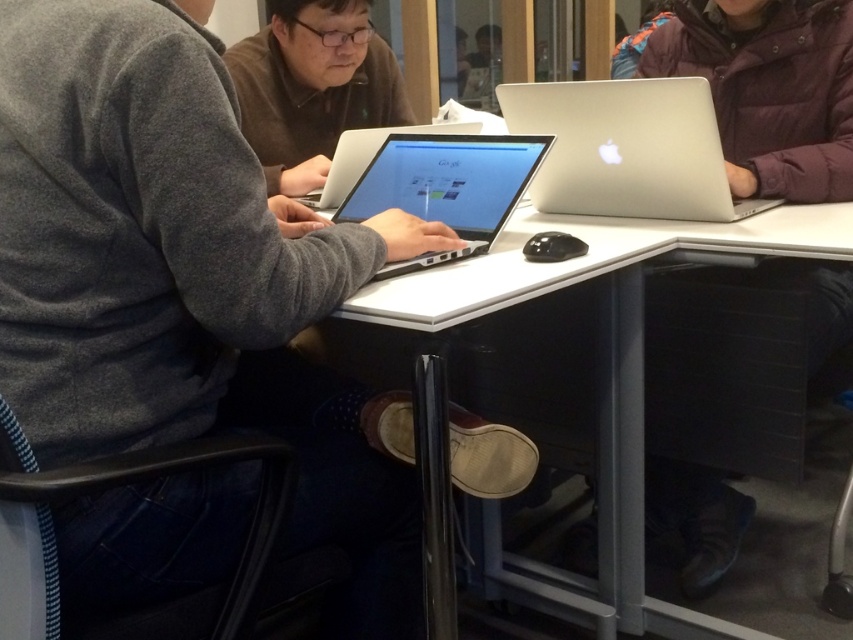
Question: Does silver metallic laptop at upper right appear over silver metallic laptop at center?

Choices:
 (A) yes
 (B) no

Answer: (A)

Question: Is white glossy table at center further to the viewer compared to matte black laptop at center?

Choices:
 (A) no
 (B) yes

Answer: (A)

Question: Among these points, which one is farthest from the camera?

Choices:
 (A) (724, 211)
 (B) (582, 275)
 (C) (331, 172)
 (D) (347, 212)

Answer: (C)

Question: Is the position of matte black laptop at center less distant than that of silver metallic laptop at center?

Choices:
 (A) yes
 (B) no

Answer: (B)

Question: Which object is farther from the camera taking this photo?

Choices:
 (A) white glossy table at center
 (B) matte black laptop at center

Answer: (B)

Question: Which of these objects is positioned farthest from the matte black laptop at center?

Choices:
 (A) silver metallic laptop at center
 (B) sleek silver laptop at center
 (C) silver metallic laptop at upper right
 (D) white glossy table at center

Answer: (D)